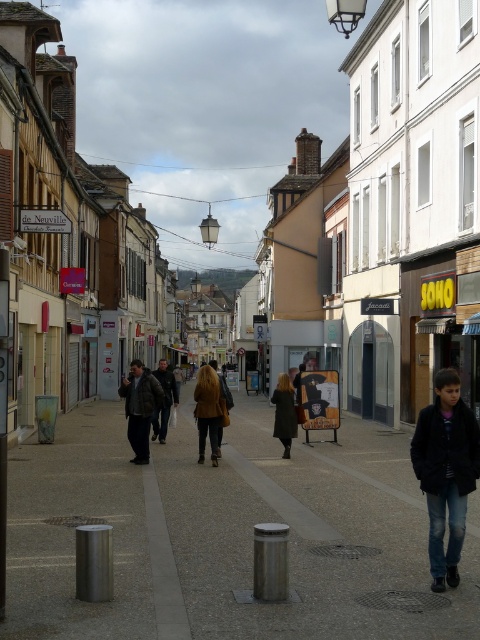
You are a pedestrian walking down the street and notice a matte black sign at center and a yellow fabric bag at center. Which object is positioned higher relative to the other?

The matte black sign at center is positioned above the yellow fabric bag at center, so it is higher.

You are standing at the point with coordinates point (456, 512) and want to walk towards the point with coordinates point (233, 451). Which direction should you move in relation to the street scene?

You should move forward towards the point (233, 451) because it is behind point (456, 512) in the street scene.

Consider the image. You are standing on the street in this European town. You notice a point marked at coordinates [228,534]. What type of surface is located at that point?

The point at coordinates [228,534] marks the location of a smooth concrete sidewalk at center.